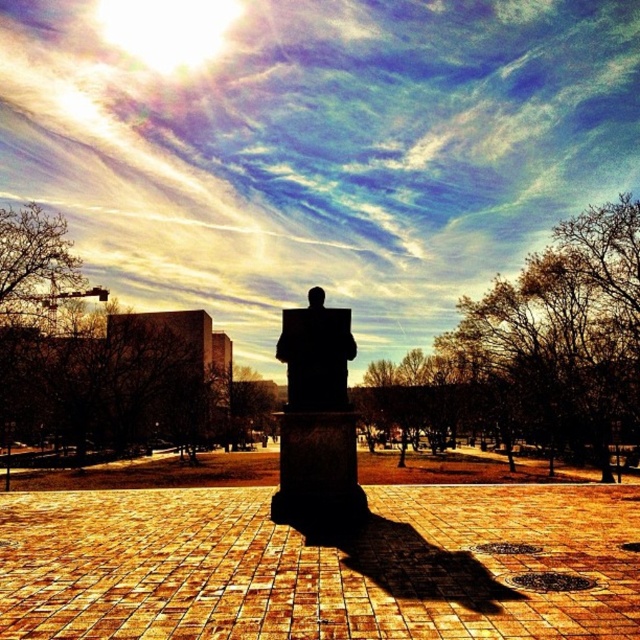
Question: Which object appears closest to the camera in this image?

Choices:
 (A) silhouette stone statue at center
 (B) black stone statue at center

Answer: (A)

Question: Is silhouette stone statue at center positioned behind black stone statue at center?

Choices:
 (A) yes
 (B) no

Answer: (B)

Question: Which point is closer to the camera taking this photo?

Choices:
 (A) (300, 403)
 (B) (291, 488)

Answer: (B)

Question: Does silhouette stone statue at center have a smaller size compared to black stone statue at center?

Choices:
 (A) no
 (B) yes

Answer: (B)

Question: Is the position of silhouette stone statue at center less distant than that of black stone statue at center?

Choices:
 (A) yes
 (B) no

Answer: (A)